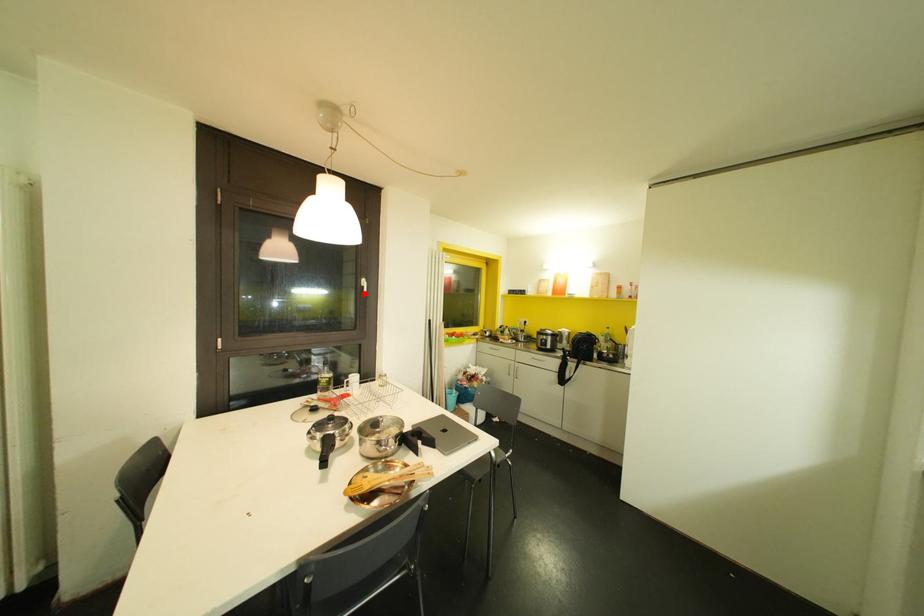
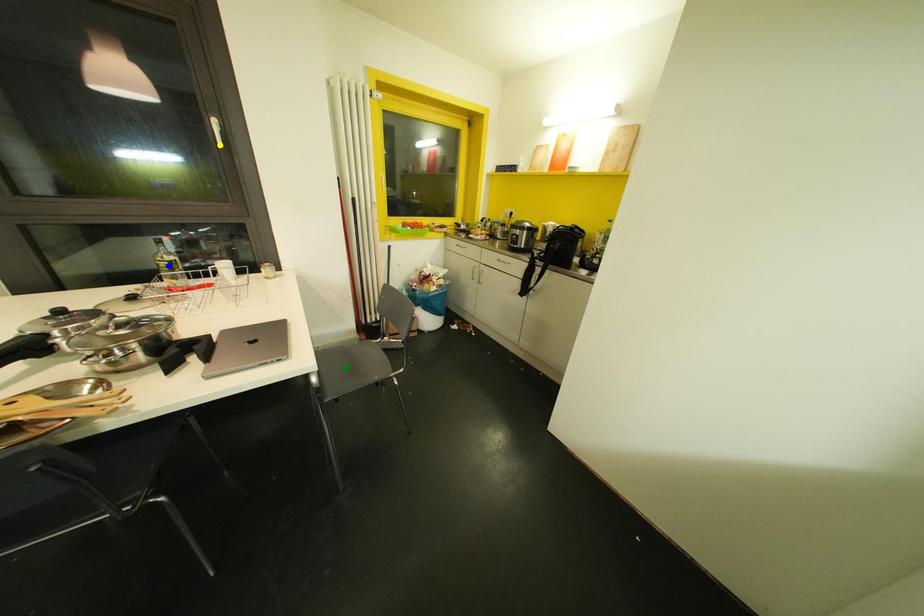
Question: I am providing you with two images of the same scene from different viewpoints. A red point is marked on the first image. You are given multiple points on the second image. Which point in image 2 is actually the same real-world point as the red point in image 1?

Choices:
 (A) blue point
 (B) yellow point
 (C) green point

Answer: (B)